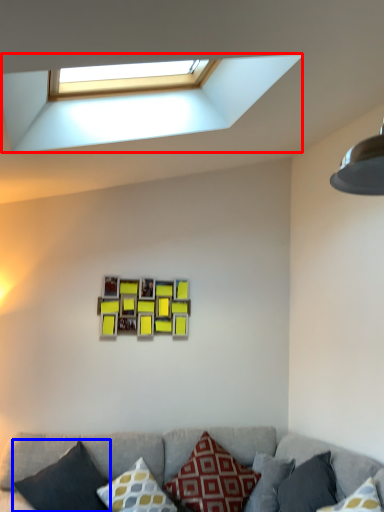
Question: Which object appears closest to the camera in this image, window (highlighted by a red box) or pillow (highlighted by a blue box)?

Choices:
 (A) window
 (B) pillow

Answer: (A)